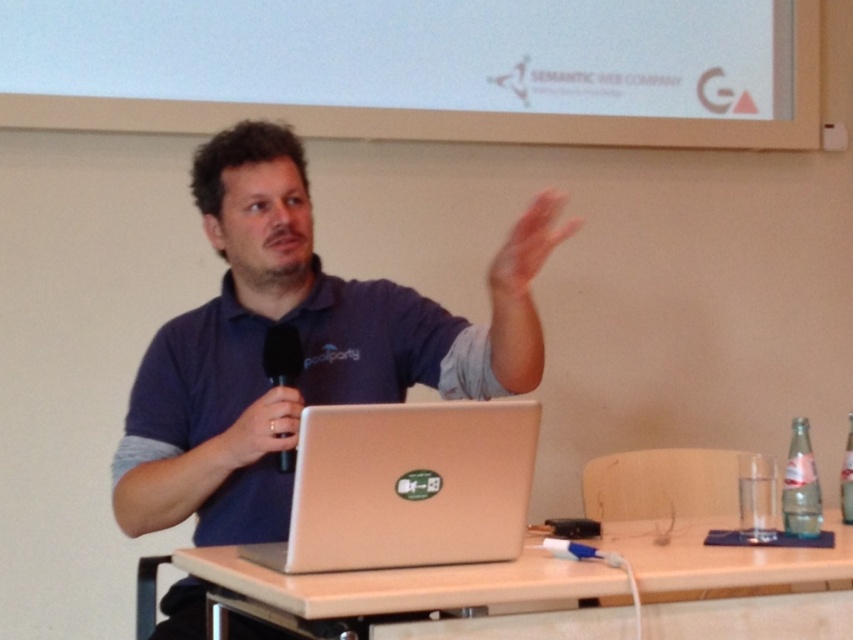
Question: Which point appears closest to the camera in this image?

Choices:
 (A) (248, 445)
 (B) (189, 339)

Answer: (A)

Question: Considering the relative positions of matte blue shirt at center and matte black microphone at center in the image provided, where is matte blue shirt at center located with respect to matte black microphone at center?

Choices:
 (A) left
 (B) right

Answer: (B)

Question: Which point appears farthest from the camera in this image?

Choices:
 (A) [x=494, y=262]
 (B) [x=602, y=536]
 (C) [x=529, y=428]
 (D) [x=231, y=269]

Answer: (D)

Question: Where is pink flesh at upper center located in relation to matte black microphone at center in the image?

Choices:
 (A) right
 (B) left

Answer: (A)

Question: Which of the following is the closest to the observer?

Choices:
 (A) matte blue shirt at center
 (B) matte black microphone at center
 (C) pink flesh at upper center
 (D) black matte microphone at center

Answer: (C)

Question: Observing the image, what is the correct spatial positioning of satin gold laptop at center in reference to black matte microphone at center?

Choices:
 (A) right
 (B) left

Answer: (A)